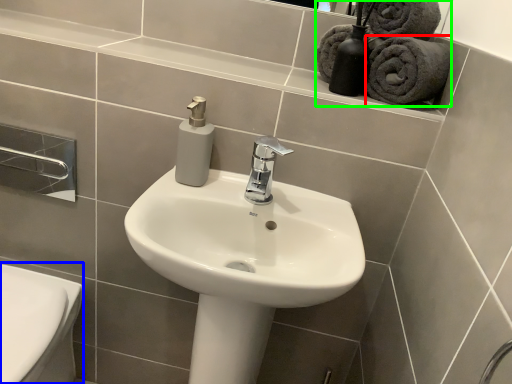
Question: Considering the real-world distances, which object is closest to bath towel (highlighted by a red box)? bidet (highlighted by a blue box) or bath towel (highlighted by a green box).

Choices:
 (A) bidet
 (B) bath towel

Answer: (B)